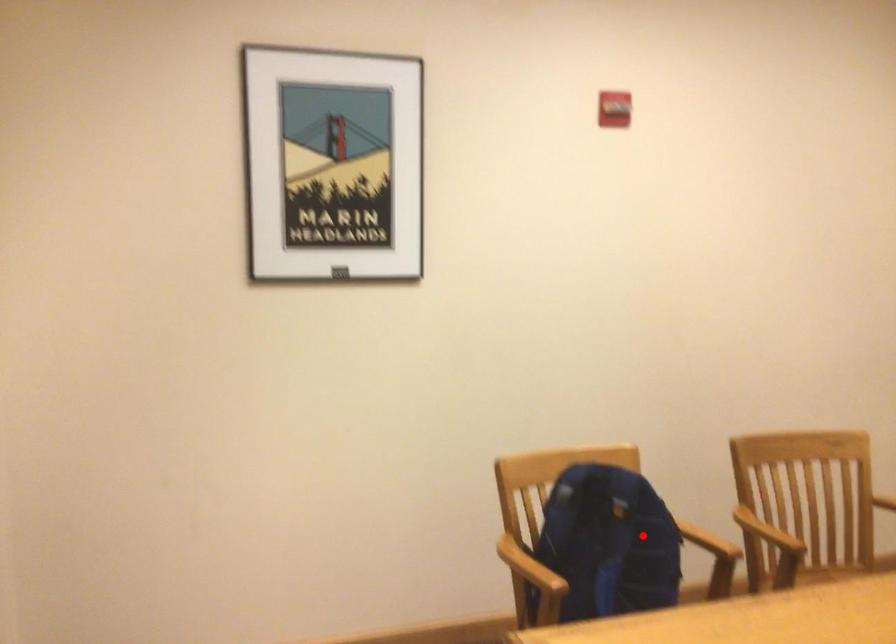
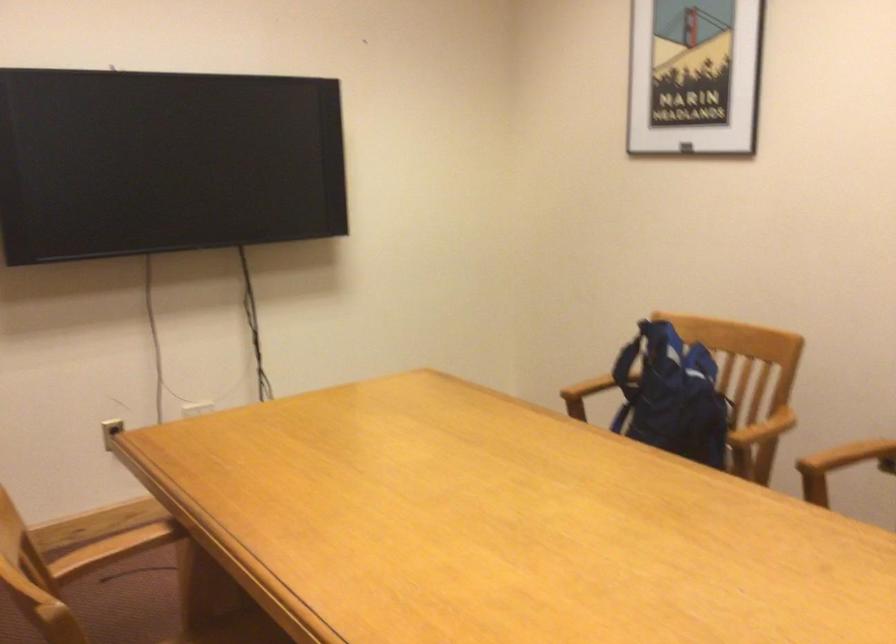
Find the pixel in the second image that matches the highlighted location in the first image.

(672, 395)